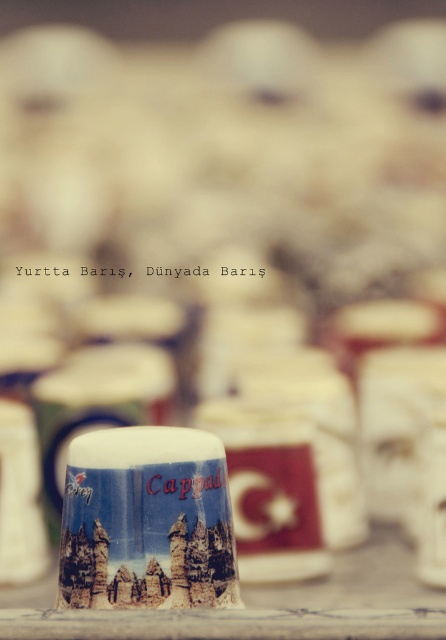
You are a barista preparing coffee and want to place a new mug on the wooden table at center. Given that the blue glossy mug at center is already there, how much space is left between them?

The distance between the blue glossy mug at center and the wooden table at center is 16.79 inches, so there is enough space to place the new mug without moving the existing one.

You are setting up a small table for a peaceful tea ceremony. You have a wooden table at center and a matte ceramic mug at center. Which object is shorter?

The wooden table at center is not as tall as the matte ceramic mug at center, so the wooden table at center is shorter.

From the picture: You are a photographer using a camera with a focal length of 50mm. You want to take a closeup photo of the blue glossy mug at center. Given that the camera and the mug are 78.32 centimeters apart, what is the minimum distance you need to move the camera backward to focus on an object 1 meter away without changing the focal length?

The blue glossy mug at center is currently 78.32 centimeters away from the camera. To focus on an object 1 meter away, you need to move the camera backward so that the distance becomes 1 meter. Therefore, you should move the camera backward by 21.68 centimeters.